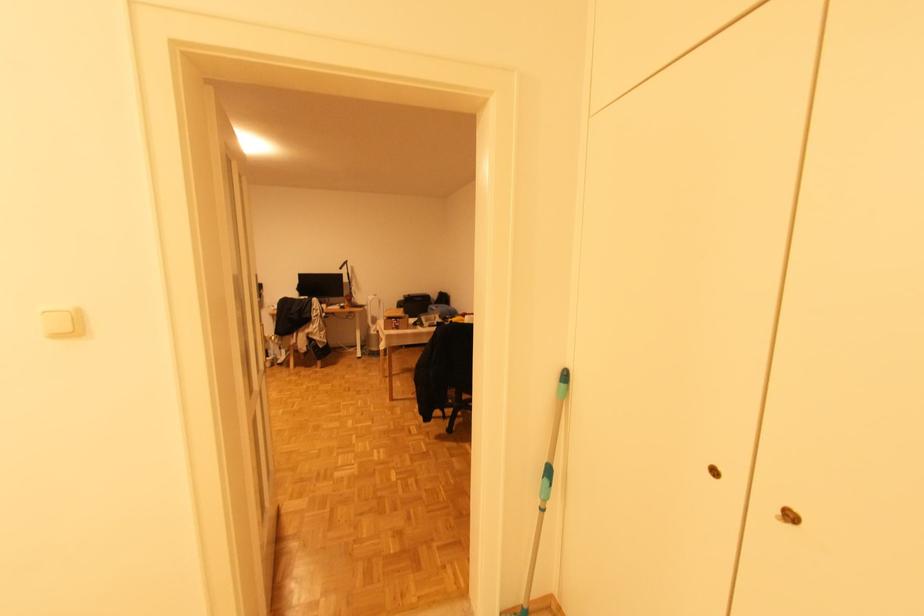
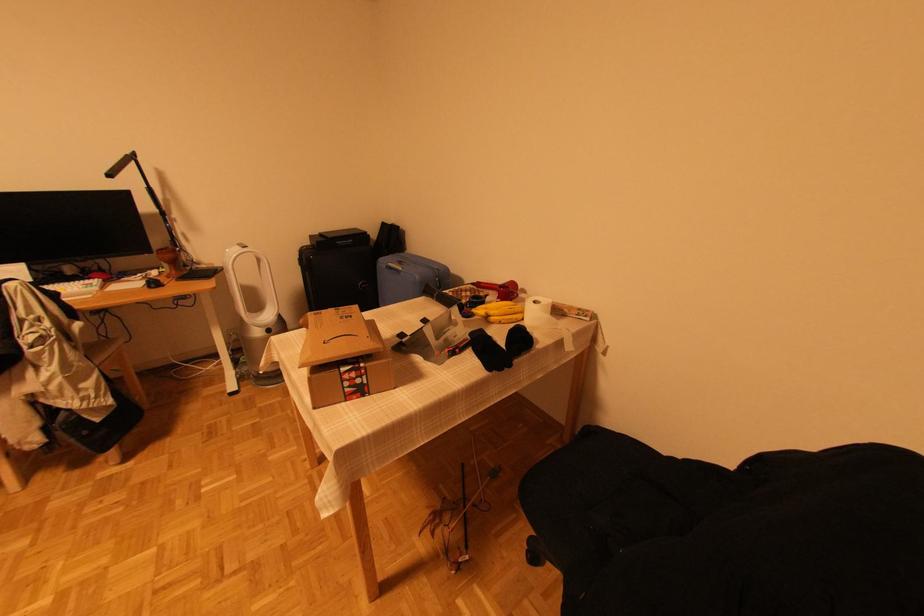
Locate, in the second image, the point that corresponds to (468,322) in the first image.

(525, 313)